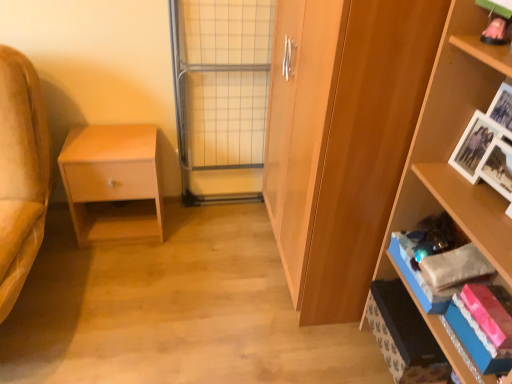
You are a GUI agent. You are given a task and a screenshot of the screen. Output one action in this format:
    pyautogui.click(x=<x>, y=<y>)
    Task: Click on the free space above blue cardboard box at lower right (from a real-world perspective)
    Image resolution: width=512 pixels, height=384 pixels.
    Given the screenshot: What is the action you would take?
    pyautogui.click(x=411, y=317)